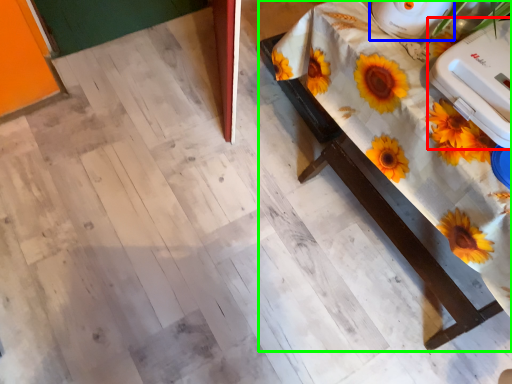
Question: Which object is positioned closest to appliance (highlighted by a red box)? Select from appliance (highlighted by a blue box) and table (highlighted by a green box).

Choices:
 (A) appliance
 (B) table

Answer: (A)